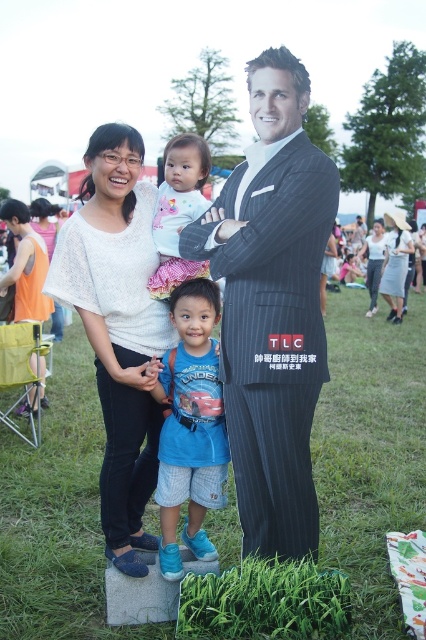
You are a photographer at the event and want to capture a photo of the white knitwear at center. Where should you aim your camera to include it in the frame?

The white knitwear at center is located at the coordinates point (118, 326), so aim your camera towards that position to include it in the frame.

You are a photographer at the event and want to capture a photo of both the white knitwear at center and the white cotton onesie at center. Since you need to ensure both are clearly visible, which one should you focus on first to account for their sizes?

The white knitwear at center is bigger than the white cotton onesie at center, so you should focus on the white knitwear at center first to ensure it is in clear view before adjusting for the smaller one.